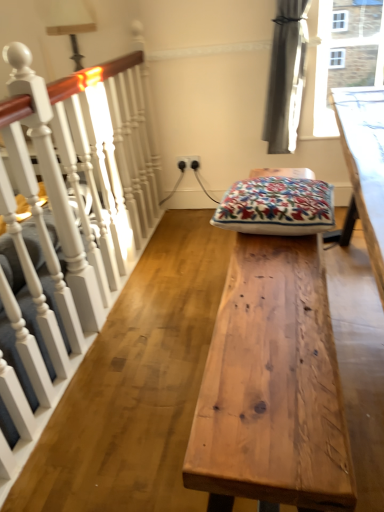
The width and height of the screenshot is (384, 512). I want to click on vacant region in front of embroidered cotton cushion at center, so click(x=272, y=268).